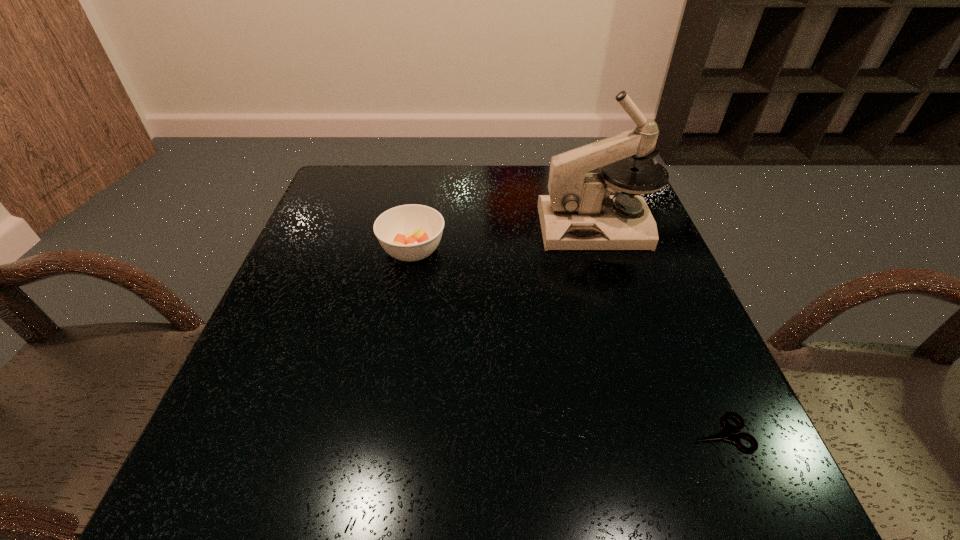
The height and width of the screenshot is (540, 960). I want to click on free spot that satisfies the following two spatial constraints: 1. at the eyepiece of the microscope; 2. on the back side of the shortest object, so click(661, 433).